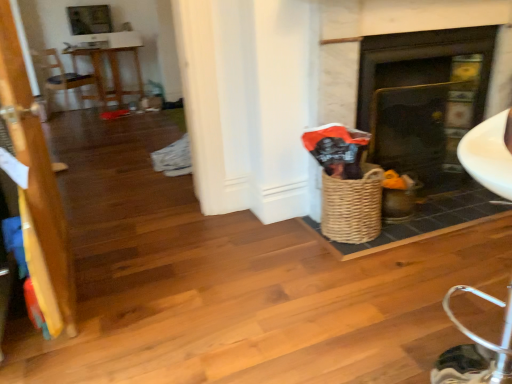
What is the approximate height of wooden table at upper left?

It is 29.74 inches.

Where is `wooden armchair at left`? wooden armchair at left is located at coordinates (63, 79).

Image resolution: width=512 pixels, height=384 pixels. In order to click on wooden door at left in this screenshot , I will do `click(36, 188)`.

Image resolution: width=512 pixels, height=384 pixels. What do you see at coordinates (36, 188) in the screenshot?
I see `wooden door at left` at bounding box center [36, 188].

At what (x,y) coordinates should I click in order to perform the action: click on woven brown basket at right. Please return your answer as a coordinate pair (x, y). This screenshot has width=512, height=384. Looking at the image, I should click on (352, 206).

In order to face woven brown basket at right, should I rotate leftwards or rightwards?

To align with it, rotate right about 12.757°.

Find the location of `wooden table at upper left`. wooden table at upper left is located at coordinates (111, 72).

Is wooden table at upper left positioned far away from wooden armchair at left?

That's not correct — wooden table at upper left is a little close to wooden armchair at left.

Between wooden table at upper left and wooden armchair at left, which one appears on the left side from the viewer's perspective?

wooden armchair at left is more to the left.

Considering the sizes of objects wooden table at upper left and wooden armchair at left in the image provided, who is thinner, wooden table at upper left or wooden armchair at left?

wooden armchair at left is thinner.

Which is in front, point (96, 84) or point (96, 63)?

The point (96, 63) is more forward.

Does wooden armchair at left turn towards wooden table at upper left?

Yes, wooden armchair at left is turned towards wooden table at upper left.

Is wooden armchair at left positioned far away from wooden table at upper left?

wooden armchair at left is near wooden table at upper left, not far away.

Between wooden table at upper left and woven brown basket at right, which one is positioned behind?

wooden table at upper left.

From the picture: Which of these two, wooden table at upper left or woven brown basket at right, stands shorter?

woven brown basket at right.

From a real-world perspective, is wooden table at upper left over woven brown basket at right?

Yes, from a real-world perspective, wooden table at upper left is on top of woven brown basket at right.

At what (x,y) coordinates should I click in order to perform the action: click on table behind the woven brown basket at right. Please return your answer as a coordinate pair (x, y). Looking at the image, I should click on (111, 72).

From a real-world perspective, is woven brown basket at right over wooden table at upper left?

Incorrect, from a real-world perspective, woven brown basket at right is lower than wooden table at upper left.

Which is closer, (349, 218) or (112, 80)?

The point (349, 218) is closer.

Is wooden table at upper left a part of woven brown basket at right?

No.

From a real-world perspective, is woven brown basket at right physically below matte black fireplace at center?

Correct, in the physical world, woven brown basket at right is lower than matte black fireplace at center.

Is woven brown basket at right to the right of matte black fireplace at center from the viewer's perspective?

No.

Consider the image. From the image's perspective, is woven brown basket at right on top of matte black fireplace at center?

No, from the image's perspective, woven brown basket at right is not on top of matte black fireplace at center.

Is matte black fireplace at center surrounded by wooden table at upper left?

No, matte black fireplace at center is not a part of wooden table at upper left.

Considering the relative sizes of wooden table at upper left and matte black fireplace at center in the image provided, is wooden table at upper left taller than matte black fireplace at center?

No.

Is wooden table at upper left oriented towards matte black fireplace at center?

Yes, wooden table at upper left is turned towards matte black fireplace at center.

From the image's perspective, is wooden table at upper left below matte black fireplace at center?

Incorrect, from the image's perspective, wooden table at upper left is higher than matte black fireplace at center.

Based on the photo, which point is more forward, (57,87) or (368,57)?

The point (368,57) is closer.

Considering the relative sizes of wooden armchair at left and matte black fireplace at center in the image provided, is wooden armchair at left smaller than matte black fireplace at center?

Actually, wooden armchair at left might be larger than matte black fireplace at center.

From a real-world perspective, which object rests below the other?

wooden armchair at left is physically lower.

Is wooden armchair at left to the left of matte black fireplace at center from the viewer's perspective?

Yes.

This screenshot has width=512, height=384. Find the location of `armchair below the wooden table at upper left (from the image's perspective)`. armchair below the wooden table at upper left (from the image's perspective) is located at coordinates (63, 79).

Where is `table behind the wooden armchair at left`? This screenshot has height=384, width=512. table behind the wooden armchair at left is located at coordinates (111, 72).

When comparing their distances from wooden door at left, does wooden table at upper left or matte black fireplace at center seem further?

wooden table at upper left is further to wooden door at left.

Based on their spatial positions, is wooden table at upper left or wooden armchair at left further from woven brown basket at right?

wooden armchair at left is further to woven brown basket at right.

Looking at the image, which one is located further to wooden door at left, wooden armchair at left or woven brown basket at right?

Based on the image, wooden armchair at left appears to be further to wooden door at left.

Looking at this image, from the image, which object appears to be farther from wooden armchair at left, wooden table at upper left or woven brown basket at right?

woven brown basket at right.

When comparing their distances from woven brown basket at right, does wooden door at left or matte black fireplace at center seem further?

wooden door at left.

Which object lies further to the anchor point wooden table at upper left, wooden armchair at left or matte black fireplace at center?

Among the two, matte black fireplace at center is located further to wooden table at upper left.

When comparing their distances from wooden door at left, does matte black fireplace at center or woven brown basket at right seem closer?

woven brown basket at right is positioned closer to the anchor wooden door at left.

Estimate the real-world distances between objects in this image. Which object is closer to matte black fireplace at center, wooden door at left or wooden table at upper left?

wooden door at left is positioned closer to the anchor matte black fireplace at center.

You are a GUI agent. You are given a task and a screenshot of the screen. Output one action in this format:
    pyautogui.click(x=<x>, y=<y>)
    Task: Click on the armchair between wooden door at left and wooden table at upper left along the z-axis
    This screenshot has width=512, height=384.
    Given the screenshot: What is the action you would take?
    pyautogui.click(x=63, y=79)

The height and width of the screenshot is (384, 512). Find the location of `armchair between woven brown basket at right and wooden table at upper left from front to back`. armchair between woven brown basket at right and wooden table at upper left from front to back is located at coordinates (63, 79).

Locate an element on the screen. The width and height of the screenshot is (512, 384). fireplace between woven brown basket at right and wooden table at upper left along the z-axis is located at coordinates (423, 96).

Locate an element on the screen. Image resolution: width=512 pixels, height=384 pixels. fireplace located between wooden door at left and wooden table at upper left in the depth direction is located at coordinates (423, 96).